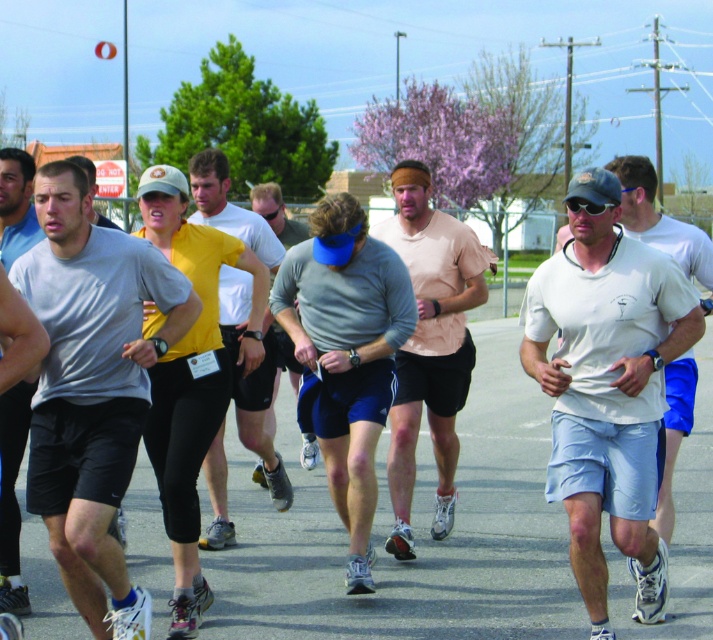
Question: Observing the image, what is the correct spatial positioning of gray matte shirt at center in reference to light pink t-shirt at center?

Choices:
 (A) below
 (B) above

Answer: (A)

Question: Does gray matte t-shirt at center come behind yellow fabric shirt at center?

Choices:
 (A) yes
 (B) no

Answer: (B)

Question: In this image, where is white matte t-shirt at center located relative to yellow fabric shirt at center?

Choices:
 (A) left
 (B) right

Answer: (B)

Question: Which object appears farthest from the camera in this image?

Choices:
 (A) light pink t-shirt at center
 (B) gray matte t-shirt at center
 (C) white matte t-shirt at center
 (D) gray matte running shirt at center

Answer: (D)

Question: Among these points, which one is nearest to the camera?

Choices:
 (A) (210, 452)
 (B) (287, 368)
 (C) (5, 243)

Answer: (C)

Question: Based on their relative distances, which object is farther from the gray matte shorts at center?

Choices:
 (A) light pink t-shirt at center
 (B) gray matte shirt at center
 (C) white matte t-shirt at center

Answer: (C)